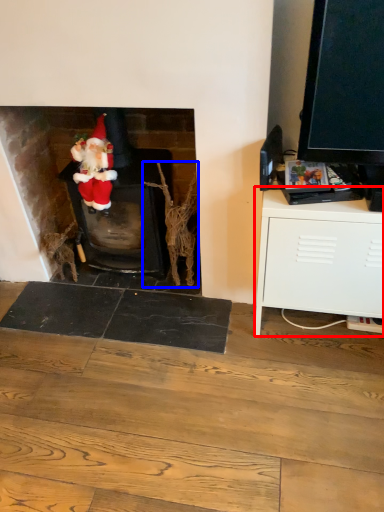
Question: Among these objects, which one is nearest to the camera, cabinetry (highlighted by a red box) or branch (highlighted by a blue box)?

Choices:
 (A) cabinetry
 (B) branch

Answer: (A)